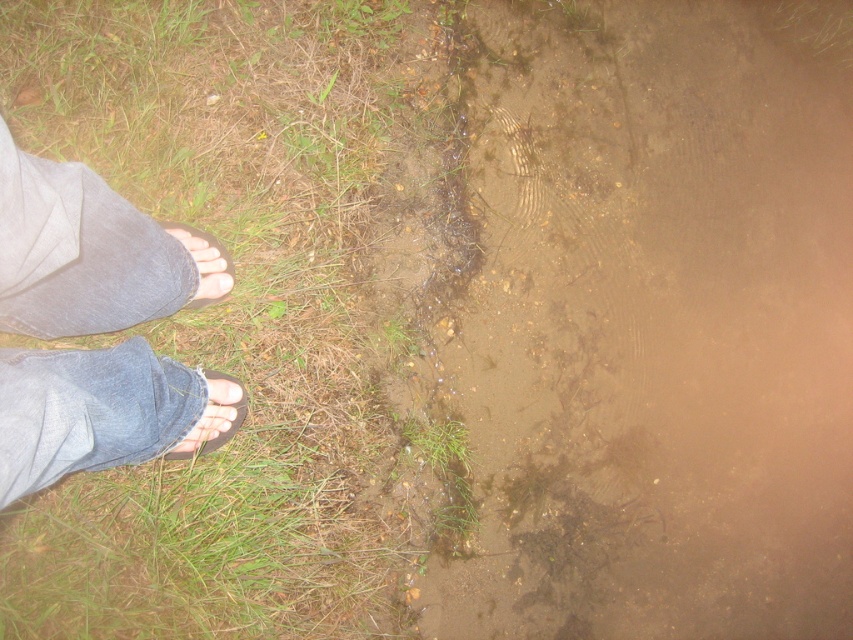
You are standing in the scene and want to step onto the green grass at lower left. Considering the brown muddy water at lower left is between you and the grass, can you reach the grass without stepping into the water?

The brown muddy water at lower left is further to the viewer than green grass at lower left, meaning the grass is closer to you. Therefore, you can step onto the green grass at lower left without stepping into the water because the grass is in front of the water.